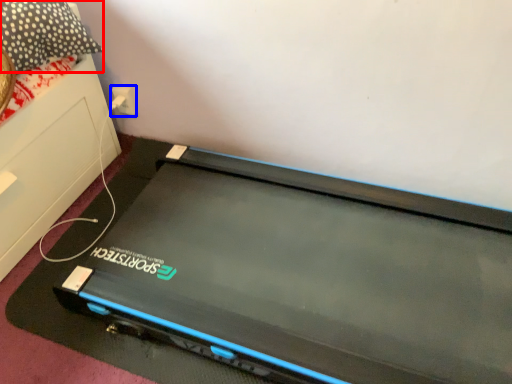
Question: Which object is closer to the camera taking this photo, pillow (highlighted by a red box) or electric outlet (highlighted by a blue box)?

Choices:
 (A) pillow
 (B) electric outlet

Answer: (A)